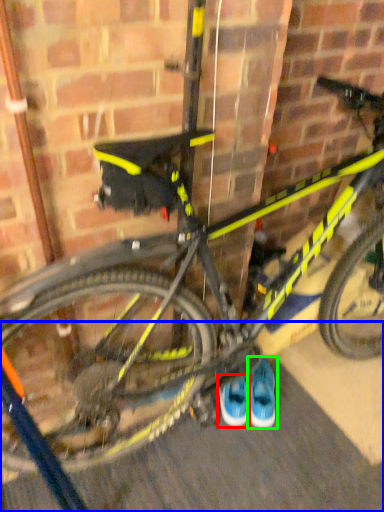
Question: Which is nearer to the footwear (highlighted by a red box)? pavement (highlighted by a blue box) or footwear (highlighted by a green box).

Choices:
 (A) pavement
 (B) footwear

Answer: (B)